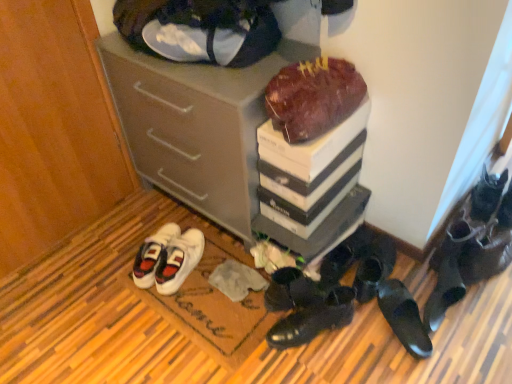
Identify the location of free location in front of matte gray cabinet at center. (178, 319).